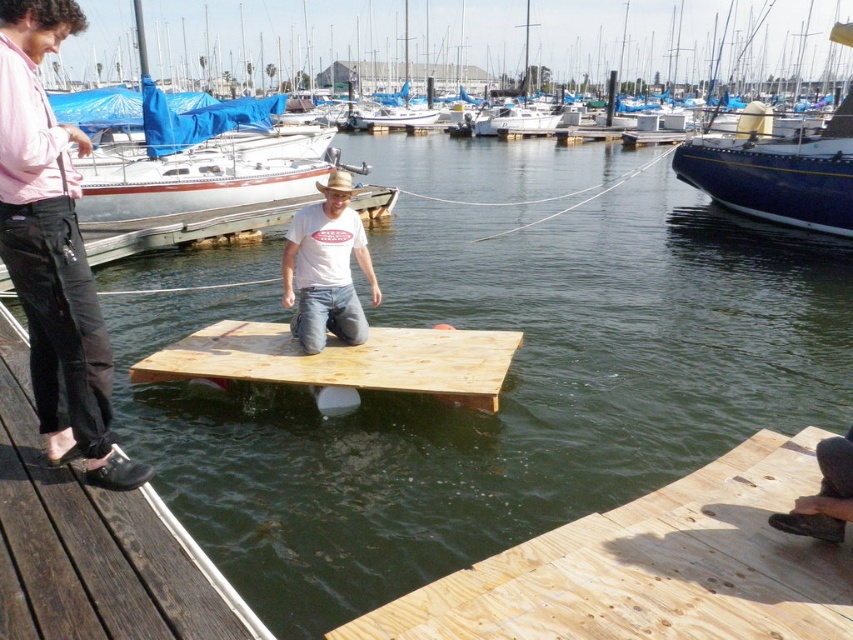
Is matte black pants at left in front of light brown wood at center?

Yes, matte black pants at left is in front of light brown wood at center.

From the picture: Who is more forward, (x=45, y=272) or (x=485, y=369)?

Point (x=45, y=272) is in front.

You are a GUI agent. You are given a task and a screenshot of the screen. Output one action in this format:
    pyautogui.click(x=<x>, y=<y>)
    Task: Click on the matte black pants at left
    The image size is (853, 640).
    Given the screenshot: What is the action you would take?
    pyautogui.click(x=53, y=250)

The width and height of the screenshot is (853, 640). In order to click on light brown wood at lower right in this screenshot , I will do `click(653, 566)`.

Looking at this image, does light brown wood at lower right appear over white cotton t-shirt at center?

No, light brown wood at lower right is not above white cotton t-shirt at center.

Is point (459, 608) closer to viewer compared to point (334, 307)?

That is True.

You are a GUI agent. You are given a task and a screenshot of the screen. Output one action in this format:
    pyautogui.click(x=<x>, y=<y>)
    Task: Click on the light brown wood at lower right
    Image resolution: width=853 pixels, height=640 pixels.
    Given the screenshot: What is the action you would take?
    pyautogui.click(x=653, y=566)

Does brown wooden dock at lower left lie in front of white cotton t-shirt at center?

Yes.

Where is `brown wooden dock at lower left`? The image size is (853, 640). brown wooden dock at lower left is located at coordinates (126, 568).

Locate an element on the screen. This screenshot has height=640, width=853. brown wooden dock at lower left is located at coordinates (126, 568).